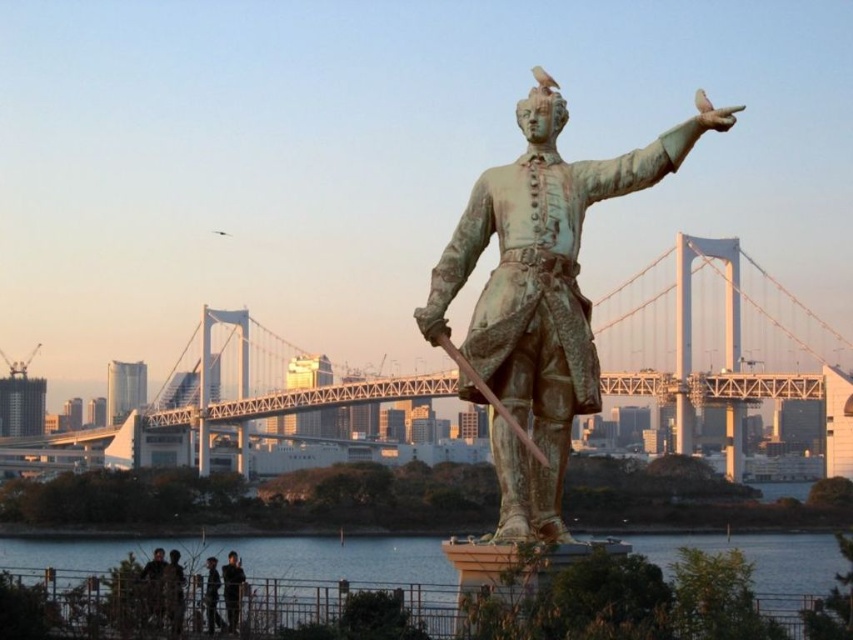
Question: Is dark brown leather jacket at lower left further to camera compared to dark gray fabric jacket at lower center?

Choices:
 (A) yes
 (B) no

Answer: (B)

Question: Estimate the real-world distances between objects in this image. Which object is closer to the metallic suspension bridge at center?

Choices:
 (A) dark gray fabric jacket at lower center
 (B) dark clothing at lower center
 (C) dark brown leather jacket at lower left

Answer: (B)

Question: Which object is the farthest from the bronze statue at center?

Choices:
 (A) dark clothing at lower center
 (B) camouflage fabric person at lower center
 (C) dark gray fabric jacket at lower center

Answer: (C)

Question: Does metallic suspension bridge at center appear on the right side of camouflage fabric person at lower center?

Choices:
 (A) no
 (B) yes

Answer: (B)

Question: Which object is the farthest from the camouflage fabric person at lower center?

Choices:
 (A) bronze statue at center
 (B) dark brown leather jacket at lower left

Answer: (A)

Question: Does bronze statue at center have a lesser width compared to metallic suspension bridge at center?

Choices:
 (A) yes
 (B) no

Answer: (A)